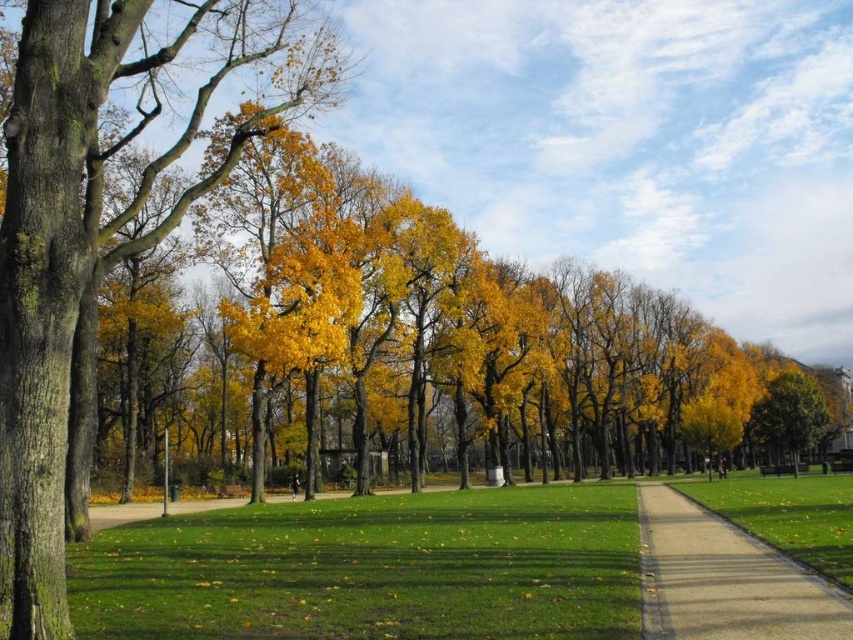
You are a gardener who needs to move a heavy wheelbarrow from the smooth concrete path at center to the golden yellow leaves at right. Considering the distance between them, will you need to make multiple trips to transport all the leaves to the path?

The distance between the smooth concrete path at center and the golden yellow leaves at right is 183.57 feet. Since the wheelbarrow can carry a significant amount of leaves in one trip, you would not need multiple trips to transport all the leaves to the path.